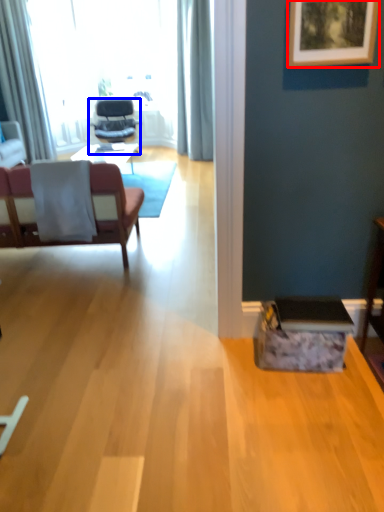
Question: Which object appears farthest to the camera in this image, picture frame (highlighted by a red box) or chair (highlighted by a blue box)?

Choices:
 (A) picture frame
 (B) chair

Answer: (B)